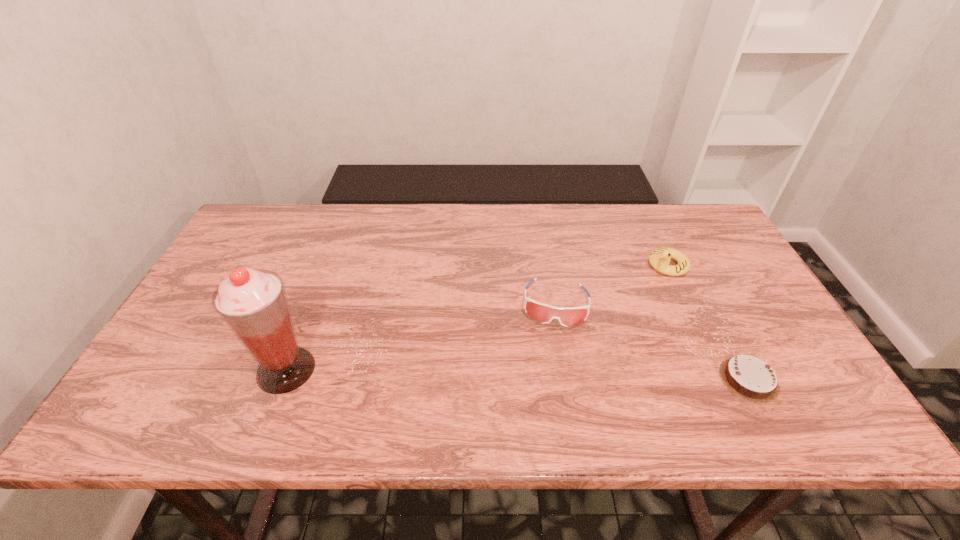
Where is `free spot between the duckling and the chocolate cake`? free spot between the duckling and the chocolate cake is located at coordinates pos(708,322).

I want to click on free space between the leftmost object and the goggles, so click(x=420, y=336).

Image resolution: width=960 pixels, height=540 pixels. Find the location of `free space between the tallest object and the shortest object`. free space between the tallest object and the shortest object is located at coordinates point(517,375).

In order to click on free space that is in between the tallest object and the duckling in this screenshot , I will do `click(477, 318)`.

Locate an element on the screen. The width and height of the screenshot is (960, 540). object that is the second closest to the chocolate cake is located at coordinates (659, 258).

Image resolution: width=960 pixels, height=540 pixels. What are the coordinates of `object that is the closest one to the second farthest object` in the screenshot? It's located at (659, 258).

Where is `vacant space that satisfies the following two spatial constraints: 1. on the back side of the smoothie; 2. on the left side of the third nearest object`? The image size is (960, 540). vacant space that satisfies the following two spatial constraints: 1. on the back side of the smoothie; 2. on the left side of the third nearest object is located at coordinates (311, 303).

Find the location of a particular element. free space that satisfies the following two spatial constraints: 1. on the back side of the farthest object; 2. on the right side of the third object from right to left is located at coordinates (549, 265).